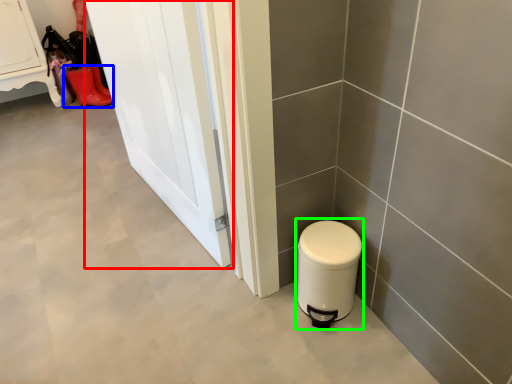
Question: Which object is the closest to the door (highlighted by a red box)? Choose among these: footwear (highlighted by a blue box) or water heater (highlighted by a green box).

Choices:
 (A) footwear
 (B) water heater

Answer: (B)